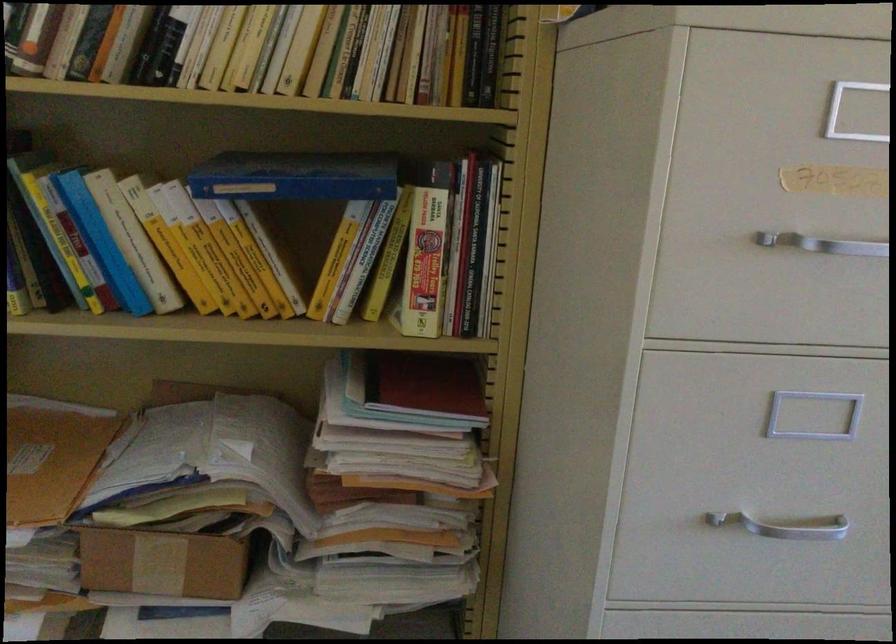
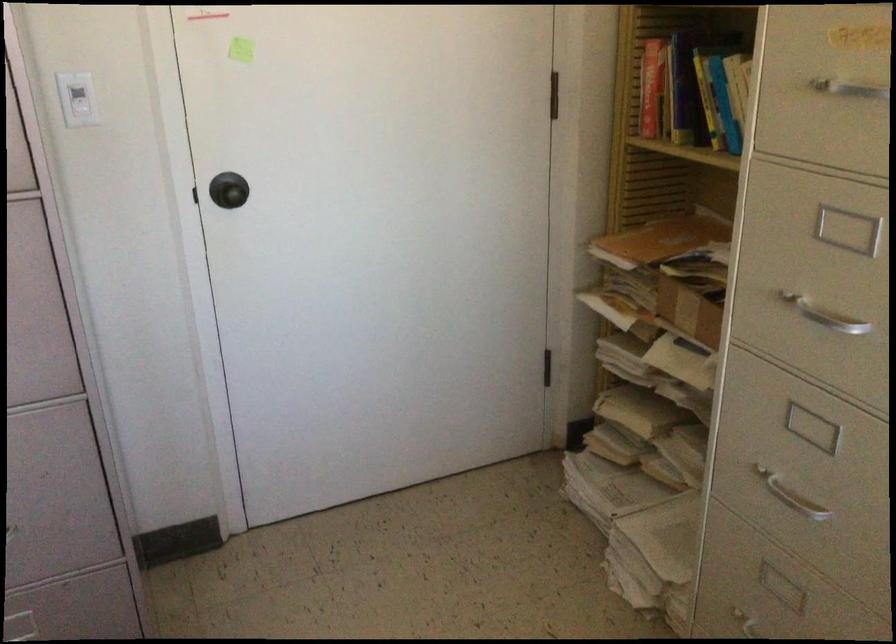
Locate, in the second image, the point that corresponds to the point at 188,561 in the first image.

(688, 310)